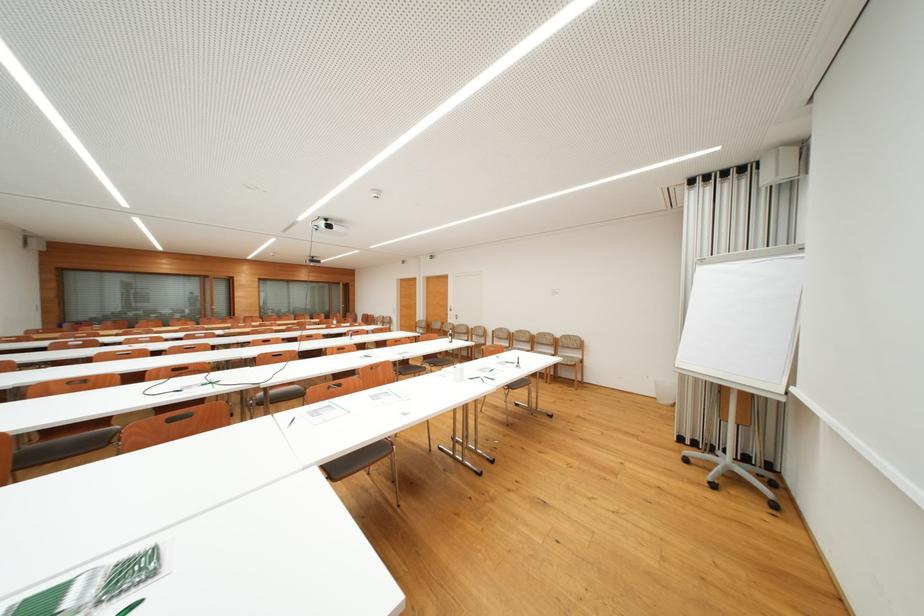
You are a GUI agent. You are given a task and a screenshot of the screen. Output one action in this format:
    pyautogui.click(x=<x>, y=<y>)
    Task: Click on the green pen
    The image size is (924, 616).
    Given the screenshot: What is the action you would take?
    pyautogui.click(x=290, y=422)